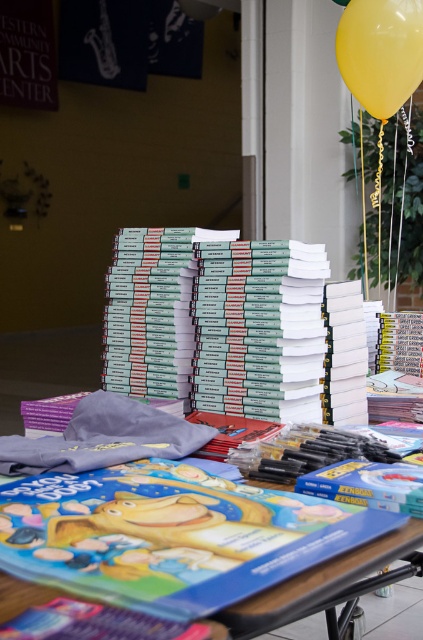
Does green matte book at center have a lesser width compared to yellow rubber balloon at upper right?

Incorrect, green matte book at center's width is not less than yellow rubber balloon at upper right's.

How much distance is there between green matte book at center and yellow rubber balloon at upper right?

The distance of green matte book at center from yellow rubber balloon at upper right is 5.79 feet.

Is point (167, 358) positioned behind point (417, 74)?

No, it is not.

Find the location of `green matte book at center`. green matte book at center is located at coordinates (231, 326).

Which is above, green matte book at center or matte plastic table at center?

green matte book at center is higher up.

Consider the image. Which of these two, green matte book at center or matte plastic table at center, stands shorter?

Standing shorter between the two is matte plastic table at center.

Describe the element at coordinates (231, 326) in the screenshot. The width and height of the screenshot is (423, 640). I see `green matte book at center` at that location.

Where is `green matte book at center`? green matte book at center is located at coordinates (231, 326).

Is matte plastic table at center above yellow rubber balloon at upper right?

Incorrect, matte plastic table at center is not positioned above yellow rubber balloon at upper right.

Can you confirm if matte plastic table at center is positioned to the right of yellow rubber balloon at upper right?

Incorrect, matte plastic table at center is not on the right side of yellow rubber balloon at upper right.

Consider the image. Who is more forward, (409,593) or (348,4)?

Point (409,593) is in front.

Locate an element on the screen. matte plastic table at center is located at coordinates (318, 582).